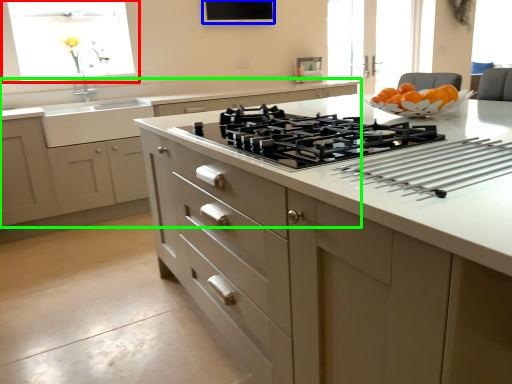
Question: Considering the real-world distances, which object is closest to window (highlighted by a red box)? window screen (highlighted by a blue box) or cabinetry (highlighted by a green box).

Choices:
 (A) window screen
 (B) cabinetry

Answer: (B)